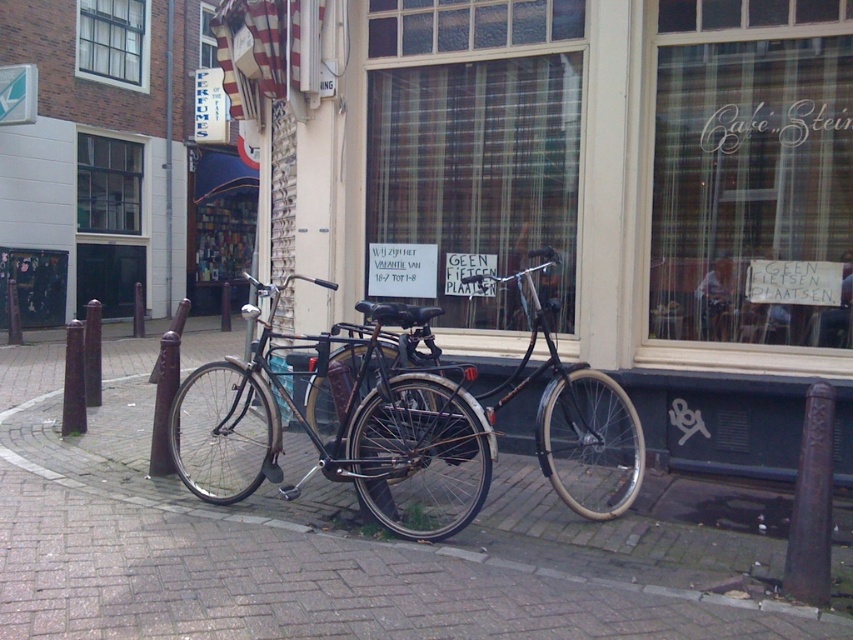
You are a delivery person who needs to place a large box on the brick pavement at center. However, there is a plaid fabric shop window at center nearby. Which object is to the left of the other? Please specify which one is on the left side.

The brick pavement at center is positioned on the left side of plaid fabric shop window at center, so the brick pavement at center is on the left side.

You are standing on the sidewalk and see two points marked on the bicycles. The first point is at coordinates point (x=674, y=182) and the second is at point (x=590, y=490). Which point is closer to you?

Point (x=590, y=490) is closer to you because it is less further to the camera than point (x=674, y=182).